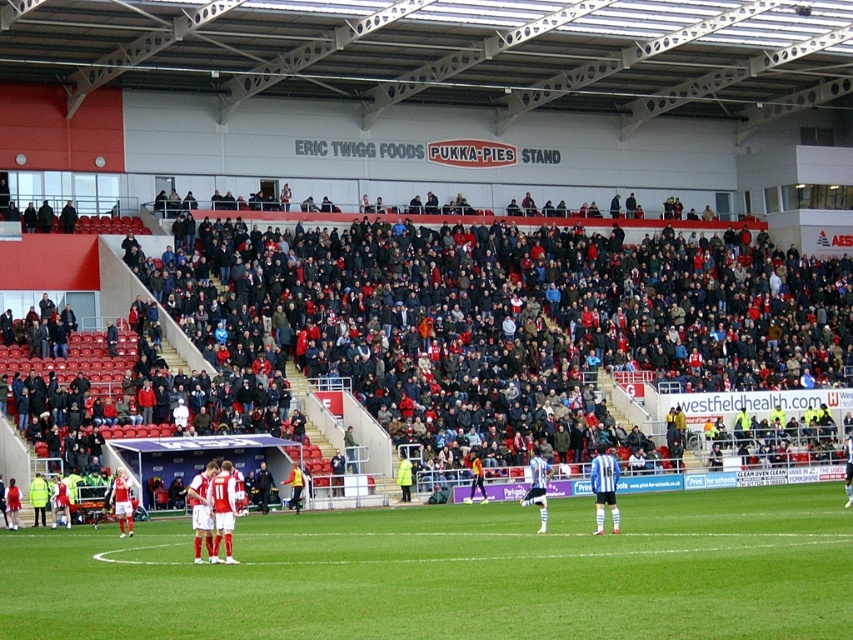
You are a photographer positioned at the point with coordinates (202, 509) in the image. What object is located exactly at your current position?

The white jersey at center is located exactly at the coordinates (202, 509).

You are a photographer standing at the camera position. You want to take a photo of the point at coordinates point (198, 509). The stadium has a rule that you must be at least 100 feet away from any point you photograph. Is your current position compliant with this rule?

The distance between the camera and point (198, 509) is 118.59 feet, which is greater than the required 100 feet. Therefore, your current position is compliant with the stadium rule.

You are a photographer at the football stadium and want to capture a photo of the dark gray clothing at center and the yellow jersey at center. If you want both objects to appear equally sized in the photo, what adjustment should you make to your camera or position?

Since the dark gray clothing at center is wider than the yellow jersey at center, you should move closer to the yellow jersey at center or farther from the dark gray clothing at center to balance their sizes in the photo.